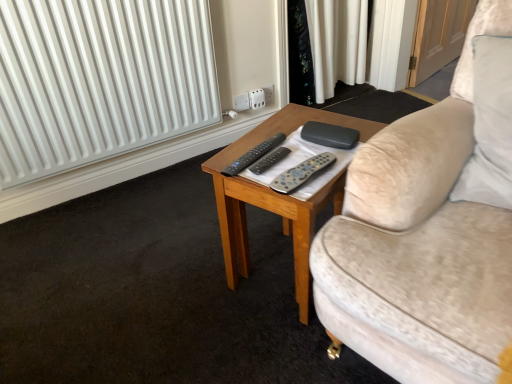
Locate an element on the screen. This screenshot has height=384, width=512. free space above wooden coffee table at center (from a real-world perspective) is located at coordinates (290, 140).